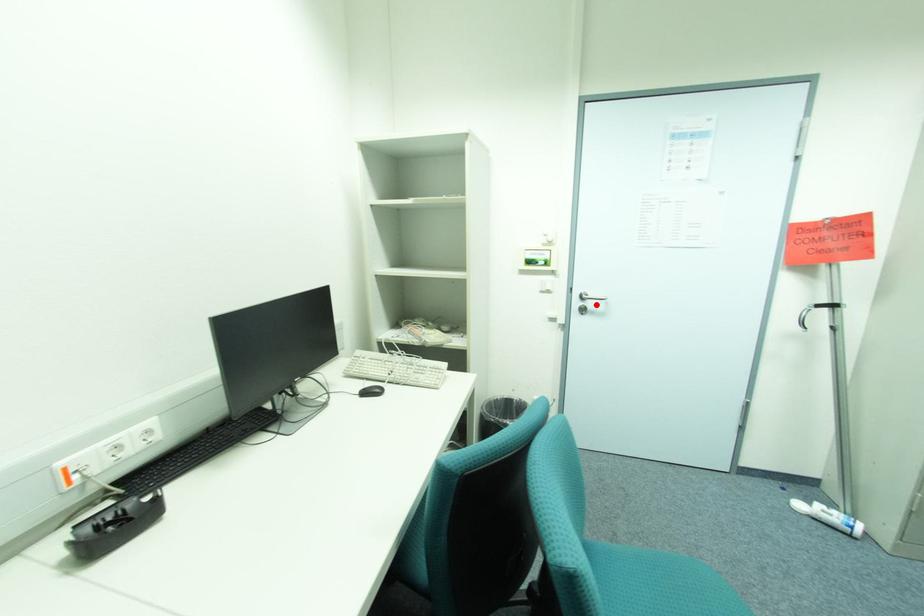
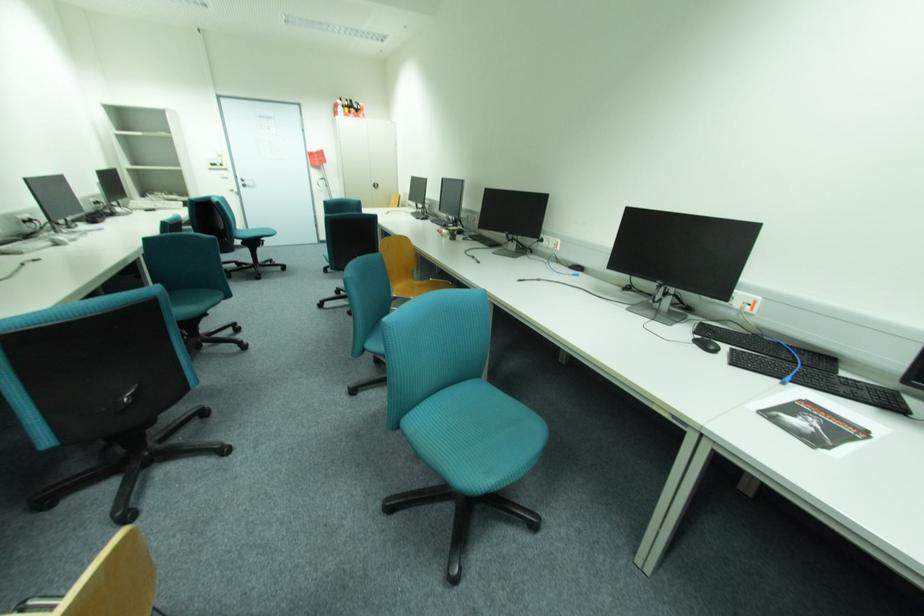
Locate, in the second image, the point that corresponds to the highlighted location in the first image.

(253, 183)